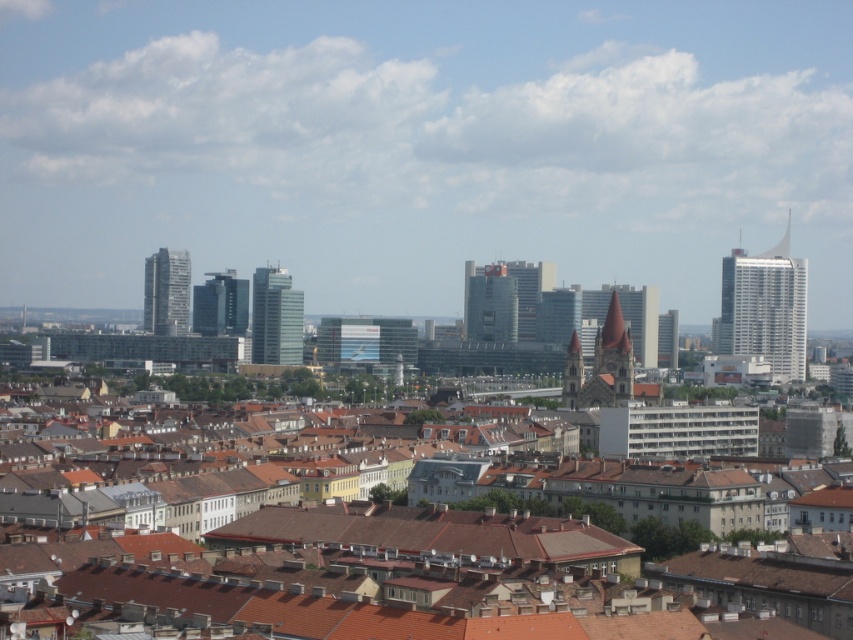
Question: Which of the following is the farthest from the observer?

Choices:
 (A) matte glass building at center
 (B) glassy reflective building at center
 (C) silver glass skyscraper at right

Answer: (B)

Question: Does matte glass building at center have a larger size compared to translucent glass skyscraper at center-left?

Choices:
 (A) no
 (B) yes

Answer: (A)

Question: Is silver glass skyscraper at right to the left of translucent glass skyscraper at center-left from the viewer's perspective?

Choices:
 (A) yes
 (B) no

Answer: (B)

Question: Can you confirm if glassy reflective skyscraper at center is smaller than glassy reflective building at center?

Choices:
 (A) no
 (B) yes

Answer: (A)

Question: Estimate the real-world distances between objects in this image. Which object is closer to the glassy reflective skyscraper at center?

Choices:
 (A) matte glass building at center
 (B) silver glass skyscraper at right
 (C) translucent glass skyscraper at center-left
 (D) glassy reflective building at center

Answer: (D)

Question: Which object is positioned farthest from the glassy reflective skyscraper at center?

Choices:
 (A) silver glass skyscraper at right
 (B) translucent glass skyscraper at center-left
 (C) matte glass building at center

Answer: (A)